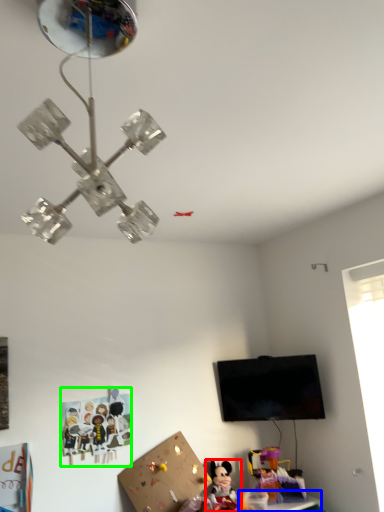
Question: Based on their relative distances, which object is nearer to toy (highlighted by a red box)? Choose from table (highlighted by a blue box) and toy (highlighted by a green box).

Choices:
 (A) table
 (B) toy

Answer: (A)